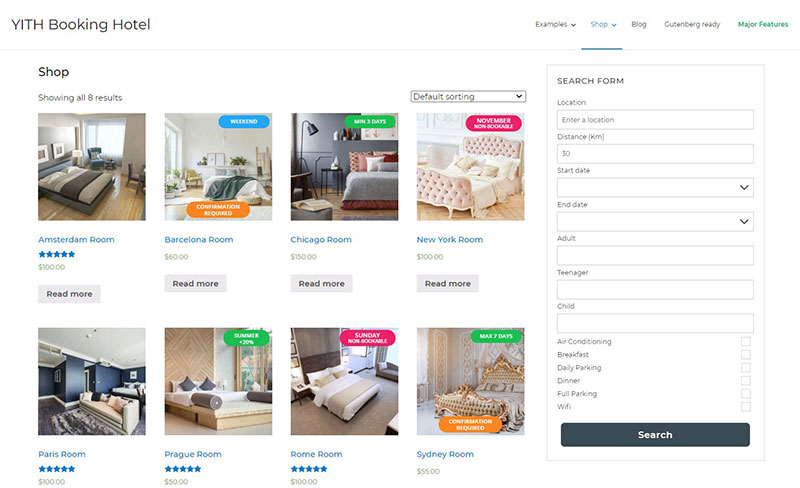
Locate an element on the screen. couch is located at coordinates (100, 408).